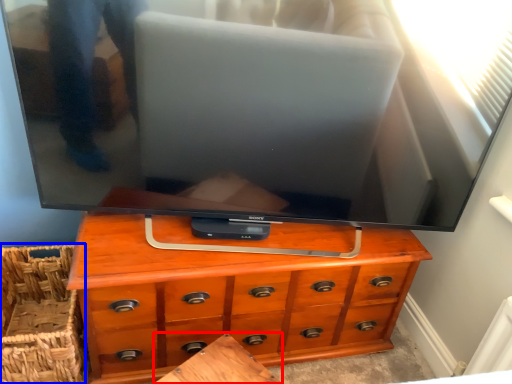
Question: Which point is closer to the camera, table (highlighted by a red box) or basket (highlighted by a blue box)?

Choices:
 (A) table
 (B) basket

Answer: (A)